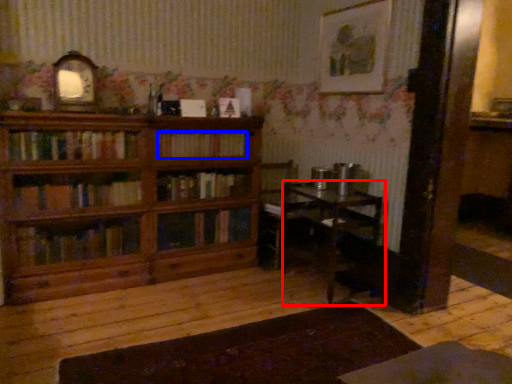
Question: Among these objects, which one is nearest to the camera, table (highlighted by a red box) or book (highlighted by a blue box)?

Choices:
 (A) table
 (B) book

Answer: (A)